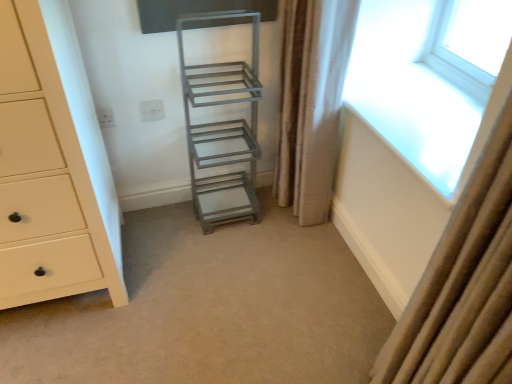
At what (x,y) coordinates should I click in order to perform the action: click on free point above metallic gray ladder at center (from a real-world perspective). Please return your answer as a coordinate pair (x, y). The width and height of the screenshot is (512, 384). Looking at the image, I should click on (198, 295).